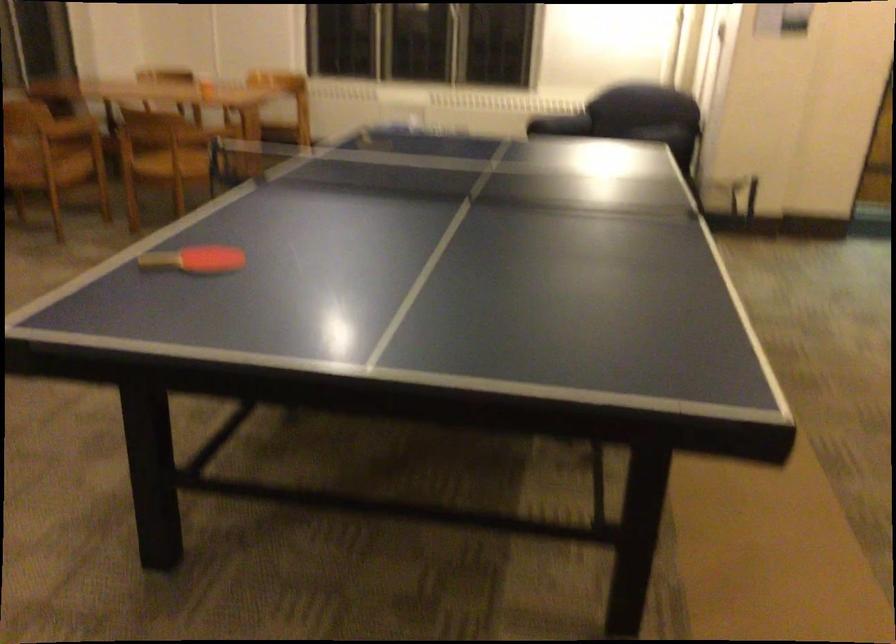
Locate an element on the screen. The image size is (896, 644). red ping-pong paddle is located at coordinates (194, 259).